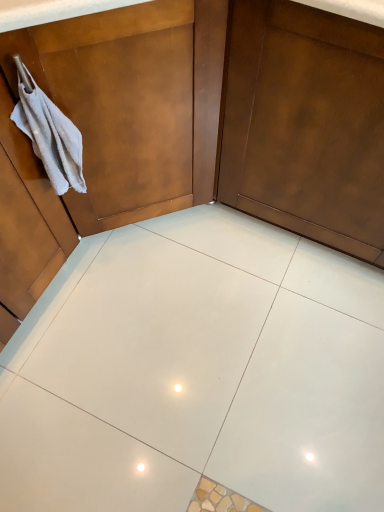
Question: From a real-world perspective, is white cotton hand towel at left positioned above or below matte brown dresser at upper left?

Choices:
 (A) below
 (B) above

Answer: (B)

Question: In terms of width, does white cotton hand towel at left look wider or thinner when compared to matte brown dresser at upper left?

Choices:
 (A) wide
 (B) thin

Answer: (B)

Question: Which of these objects is positioned closest to the matte brown dresser at upper left?

Choices:
 (A) matte brown door at center
 (B) white cotton hand towel at left
 (C) white glossy tile at center

Answer: (B)

Question: Estimate the real-world distances between objects in this image. Which object is farther from the white glossy tile at center?

Choices:
 (A) white cotton hand towel at left
 (B) matte brown dresser at upper left
 (C) matte brown door at center

Answer: (A)